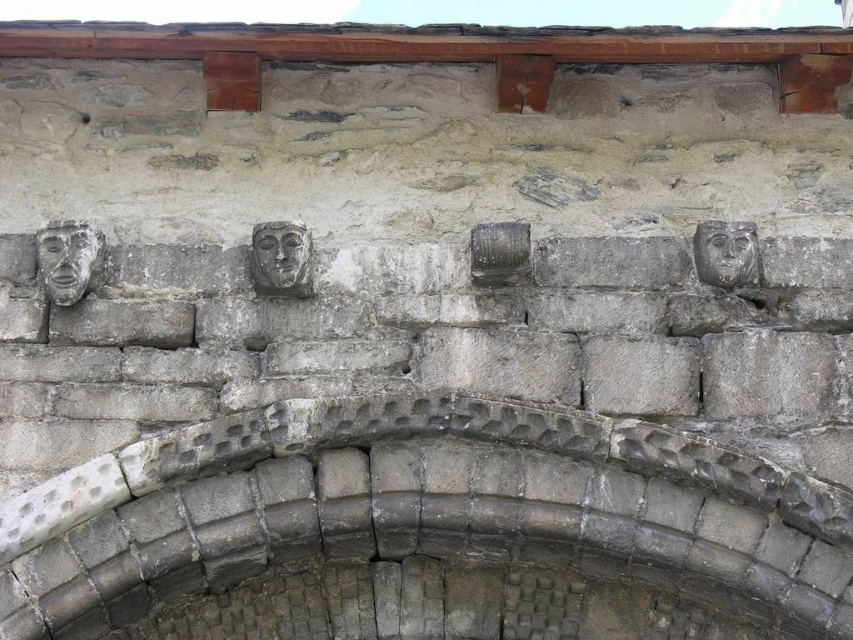
Question: Can you confirm if gray stone face at center is positioned to the left of gray stone face at upper right?

Choices:
 (A) yes
 (B) no

Answer: (A)

Question: Which of the following is the farthest from the observer?

Choices:
 (A) gray stone arch at center
 (B) gray stone face at upper right
 (C) gray stone face at center

Answer: (C)

Question: Which of the following is the farthest from the observer?

Choices:
 (A) gray stone face at upper left
 (B) gray stone face at upper right
 (C) gray stone arch at center

Answer: (B)

Question: Which object is the farthest from the gray stone face at upper left?

Choices:
 (A) gray stone arch at center
 (B) gray stone face at center
 (C) gray stone face at upper right

Answer: (C)

Question: Is gray stone face at upper left to the right of gray stone face at center from the viewer's perspective?

Choices:
 (A) no
 (B) yes

Answer: (A)

Question: Can you confirm if gray stone arch at center is wider than gray stone face at upper left?

Choices:
 (A) yes
 (B) no

Answer: (A)